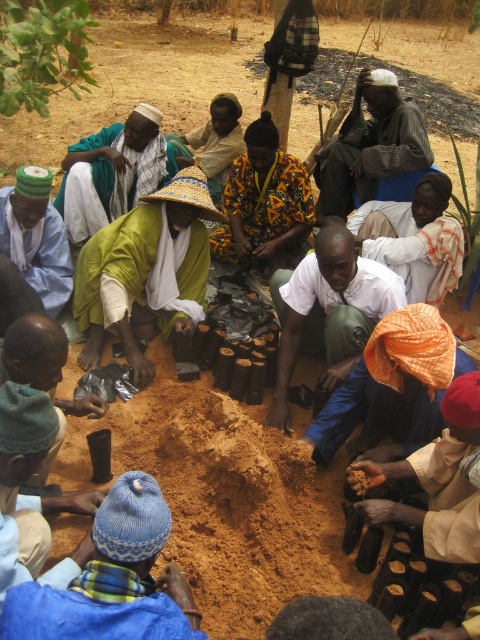
Is blue knitted hat at lower left to the right of green fabric hat at lower left from the viewer's perspective?

Correct, you'll find blue knitted hat at lower left to the right of green fabric hat at lower left.

The height and width of the screenshot is (640, 480). What do you see at coordinates (111, 579) in the screenshot? I see `blue knitted hat at lower left` at bounding box center [111, 579].

Find the location of a particular element. The width and height of the screenshot is (480, 640). blue knitted hat at lower left is located at coordinates (111, 579).

Who is shorter, white matte shirt at center or green leafy tree at upper left?

Standing shorter between the two is green leafy tree at upper left.

Who is positioned more to the left, white matte shirt at center or green leafy tree at upper left?

green leafy tree at upper left is more to the left.

Image resolution: width=480 pixels, height=640 pixels. Identify the location of white matte shirt at center. (327, 310).

Is white cotton shirt at center closer to camera compared to yellow woven hat at center?

Yes, white cotton shirt at center is closer to the viewer.

Is white cotton shirt at center wider than yellow woven hat at center?

No.

The image size is (480, 640). Identify the location of white cotton shirt at center. (415, 237).

Locate an element on the screen. white cotton shirt at center is located at coordinates (415, 237).